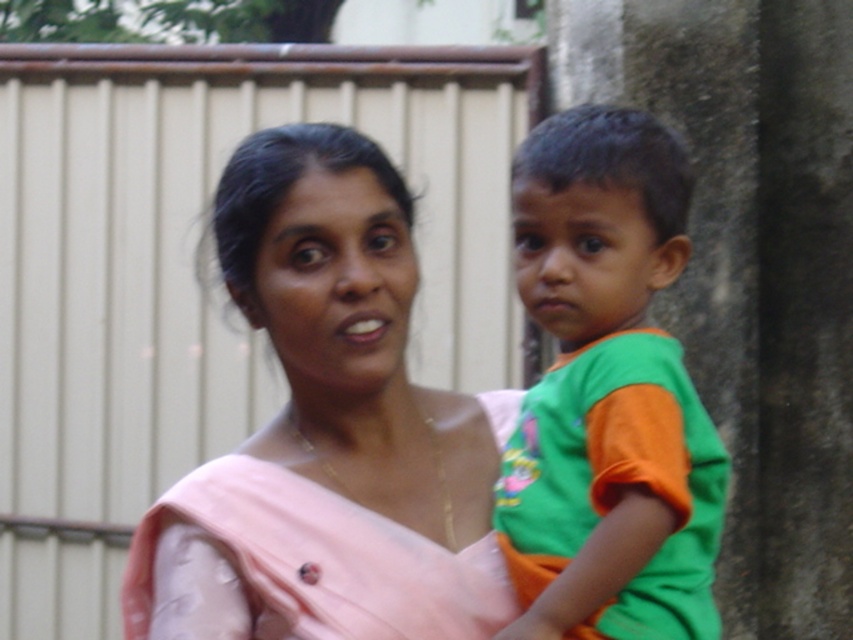
Is the position of pink fabric at center more distant than that of green cotton shirt at center?

Yes, it is.

Who is positioned more to the left, pink fabric at center or green cotton shirt at center?

Positioned to the left is pink fabric at center.

Between point (250, 541) and point (601, 369), which one is positioned in front?

Point (250, 541) is in front.

You are a GUI agent. You are given a task and a screenshot of the screen. Output one action in this format:
    pyautogui.click(x=<x>, y=<y>)
    Task: Click on the pink fabric at center
    
    Given the screenshot: What is the action you would take?
    pyautogui.click(x=329, y=429)